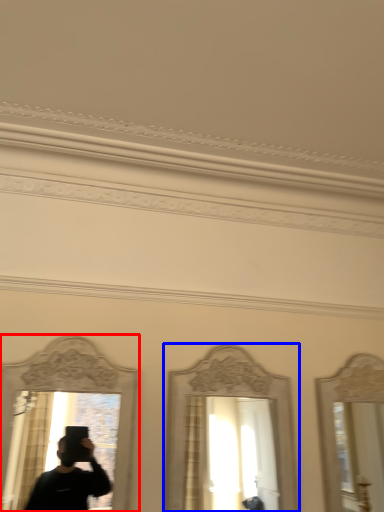
Question: Among these objects, which one is nearest to the camera, mirror (highlighted by a red box) or mirror (highlighted by a blue box)?

Choices:
 (A) mirror
 (B) mirror

Answer: (A)